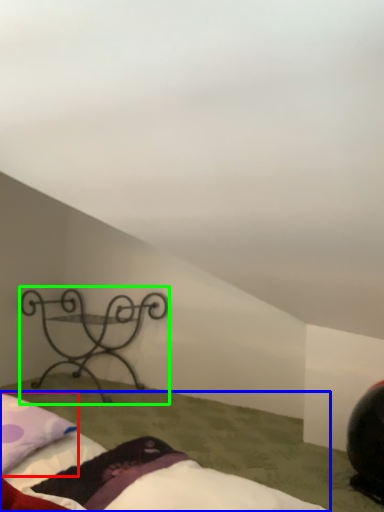
Question: Which object is positioned farthest from pillow (highlighted by a red box)? Select from bed (highlighted by a blue box) and furniture (highlighted by a green box).

Choices:
 (A) bed
 (B) furniture

Answer: (B)